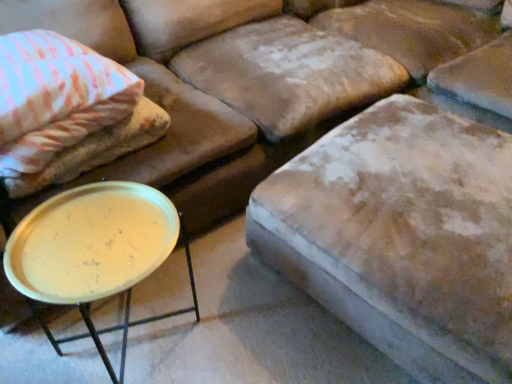
Question: Is metallic gold tray at lower left wider or thinner than velvet beige ottoman at center?

Choices:
 (A) thin
 (B) wide

Answer: (A)

Question: Is metallic gold tray at lower left bigger or smaller than velvet beige ottoman at center?

Choices:
 (A) big
 (B) small

Answer: (B)

Question: Based on their relative distances, which object is farther from the velvet beige ottoman at center?

Choices:
 (A) pink striped fabric pillow at upper left
 (B) metallic gold tray at lower left

Answer: (A)

Question: Estimate the real-world distances between objects in this image. Which object is farther from the pink striped fabric pillow at upper left?

Choices:
 (A) velvet beige ottoman at center
 (B) metallic gold tray at lower left

Answer: (A)